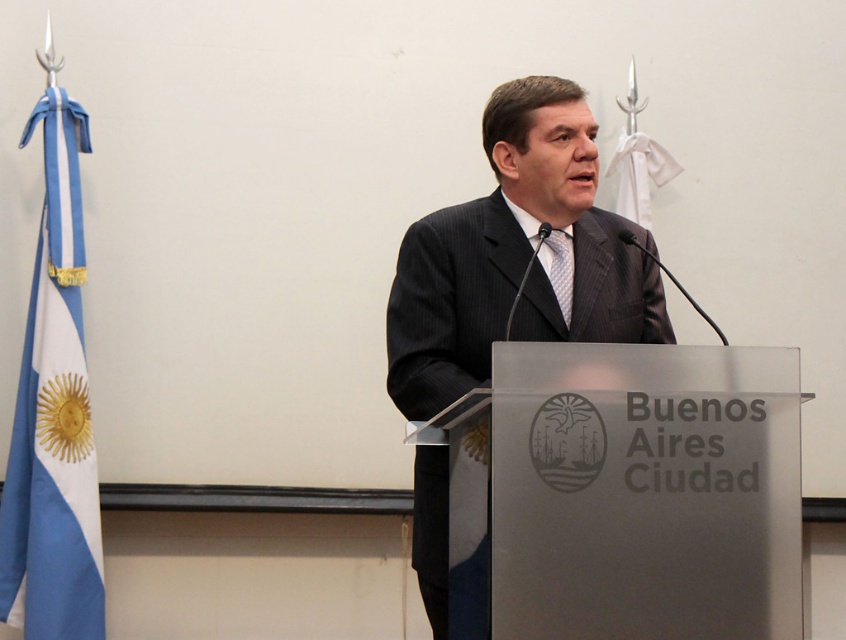
Question: Is blue fabric flag at left to the right of blue dotted tie at center from the viewer's perspective?

Choices:
 (A) no
 (B) yes

Answer: (A)

Question: Does blue fabric flag at left appear over blue dotted tie at center?

Choices:
 (A) no
 (B) yes

Answer: (A)

Question: From the image, what is the correct spatial relationship of dark gray suit at center in relation to blue dotted tie at center?

Choices:
 (A) left
 (B) right

Answer: (A)

Question: Which is nearer to the blue dotted tie at center?

Choices:
 (A) dark gray suit at center
 (B) blue fabric flag at left

Answer: (A)

Question: Which of the following is the closest to the observer?

Choices:
 (A) (37, 596)
 (B) (468, 260)

Answer: (B)

Question: Which object appears closest to the camera in this image?

Choices:
 (A) blue dotted tie at center
 (B) dark gray suit at center

Answer: (B)